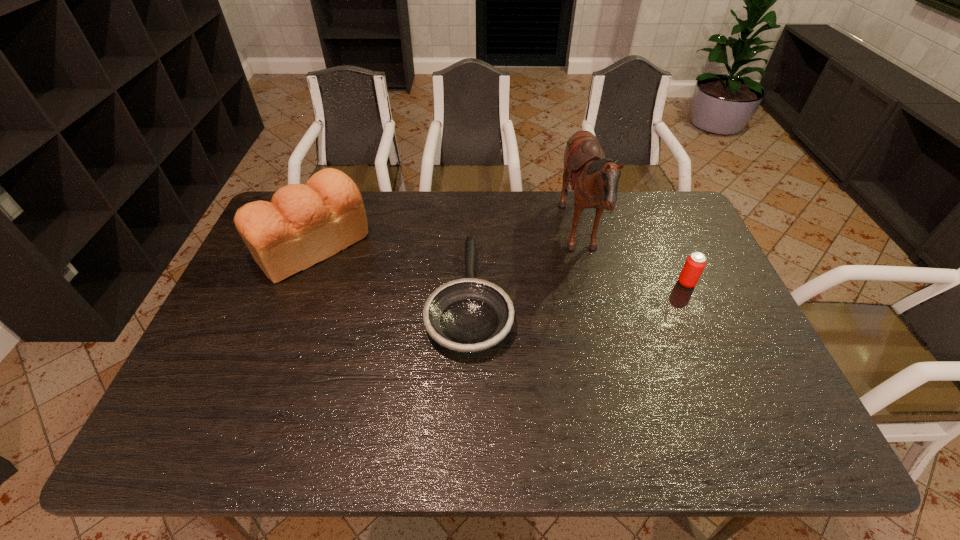
Locate an element on the screen. vacant space situated on the back of the tallest object is located at coordinates (444, 237).

The height and width of the screenshot is (540, 960). I want to click on vacant region located on the front of the third shortest object, so click(273, 348).

Identify the location of blank space located 0.370m on the front of the third tallest object. This screenshot has height=540, width=960. (741, 407).

Where is `vacant position located 0.240m on the handle side of the frying pan`? Image resolution: width=960 pixels, height=540 pixels. vacant position located 0.240m on the handle side of the frying pan is located at coordinates (471, 202).

You are a GUI agent. You are given a task and a screenshot of the screen. Output one action in this format:
    pyautogui.click(x=<x>, y=<y>)
    Task: Click on the free space located on the handle side of the frying pan
    The image size is (960, 540).
    Given the screenshot: What is the action you would take?
    pyautogui.click(x=471, y=232)

This screenshot has width=960, height=540. In order to click on vacant space located on the handle side of the frying pan in this screenshot , I will do pos(471,202).

Locate an element on the screen. saddle that is at the far edge is located at coordinates (594, 178).

Where is `bread present at the far edge`? Image resolution: width=960 pixels, height=540 pixels. bread present at the far edge is located at coordinates (304, 224).

Locate an element on the screen. The image size is (960, 540). object at the left edge is located at coordinates point(304,224).

I want to click on object that is positioned at the right edge, so click(695, 263).